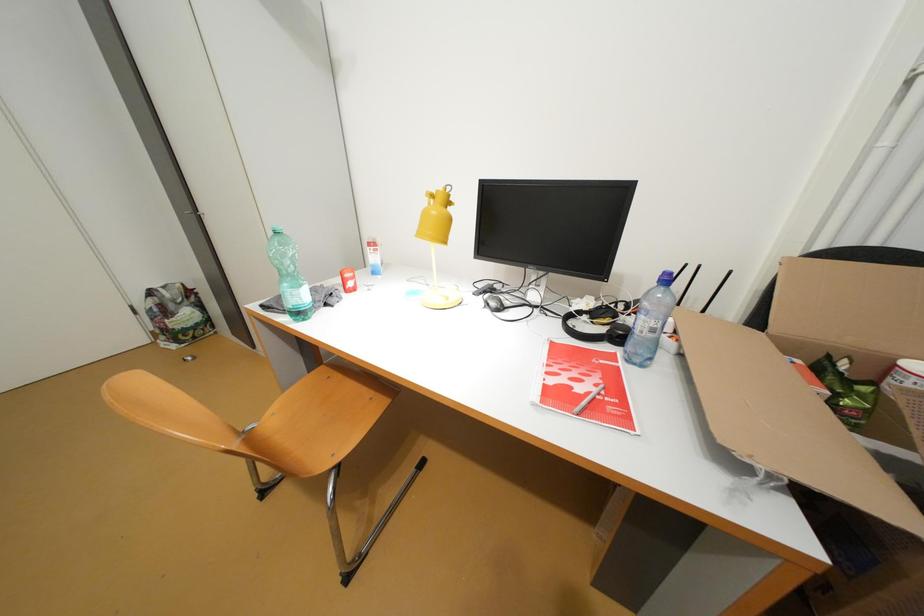
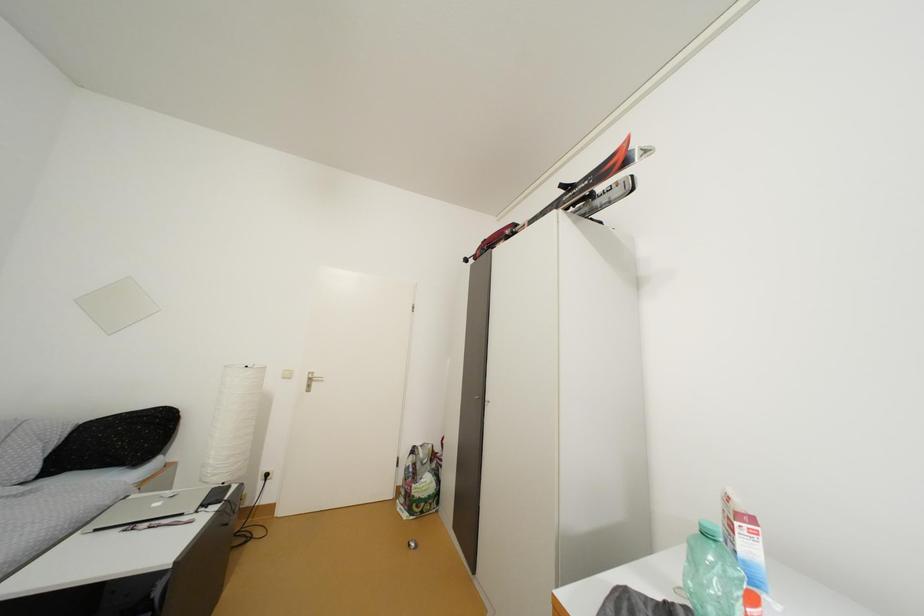
Consider the image. The first image is from the beginning of the video and the second image is from the end. How did the camera likely rotate when shooting the video?

The camera rotated toward left-up.